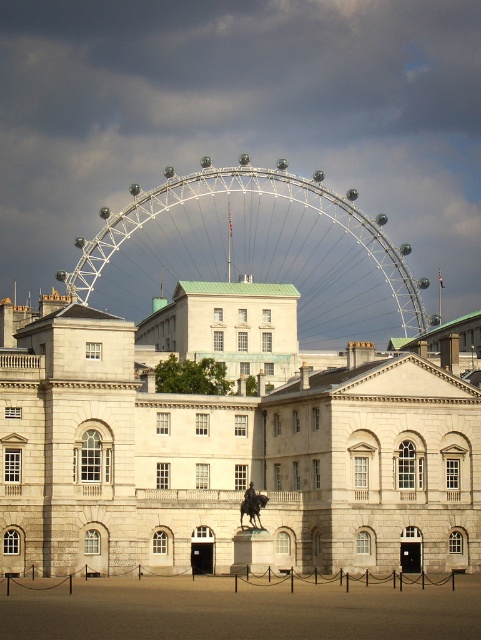
Question: Does white stone palace at center appear on the right side of white metallic ferris wheel at center?

Choices:
 (A) no
 (B) yes

Answer: (B)

Question: Which point is farther to the camera?

Choices:
 (A) white metallic ferris wheel at center
 (B) white stone palace at center

Answer: (A)

Question: Is white stone palace at center to the left of white metallic ferris wheel at center from the viewer's perspective?

Choices:
 (A) yes
 (B) no

Answer: (B)

Question: Does white stone palace at center appear under white metallic ferris wheel at center?

Choices:
 (A) yes
 (B) no

Answer: (A)